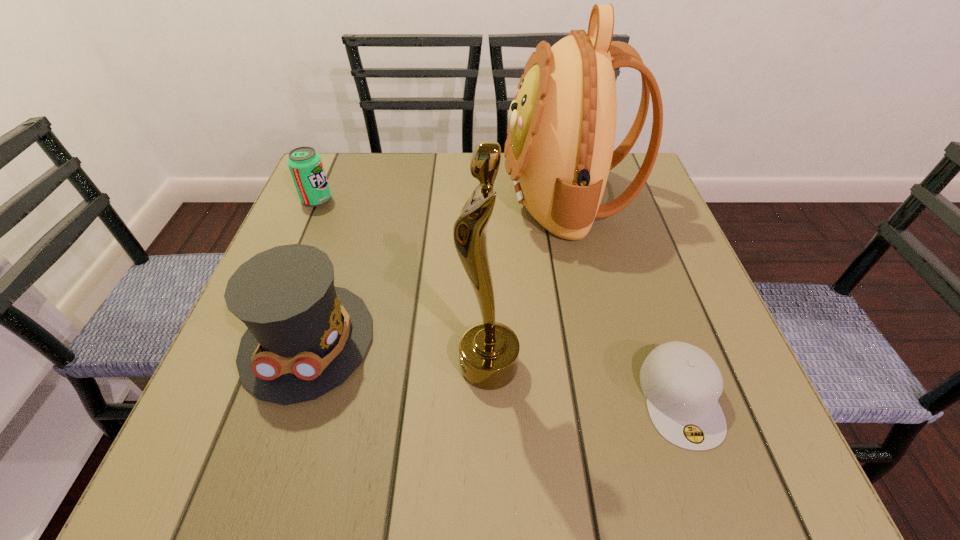
You are a GUI agent. You are given a task and a screenshot of the screen. Output one action in this format:
    pyautogui.click(x=<x>, y=<y>)
    Task: Click on the free space between the shortest object and the pop soda
    
    Given the screenshot: What is the action you would take?
    pyautogui.click(x=498, y=299)

The height and width of the screenshot is (540, 960). What are the coordinates of `free space that is in between the third tallest object and the backpack` in the screenshot? It's located at pos(437,269).

Where is `free spot between the cap and the award`? free spot between the cap and the award is located at coordinates (585, 382).

What are the coordinates of `free space between the backpack and the cap` in the screenshot? It's located at (623, 299).

Where is `empty location between the third tallest object and the award`? The height and width of the screenshot is (540, 960). empty location between the third tallest object and the award is located at coordinates (398, 353).

The width and height of the screenshot is (960, 540). In order to click on object that stands as the closest to the third shortest object in this screenshot , I will do `click(488, 351)`.

This screenshot has width=960, height=540. Find the location of `the second closest object to the second shortest object`. the second closest object to the second shortest object is located at coordinates (561, 132).

Image resolution: width=960 pixels, height=540 pixels. What are the coordinates of `free space that satisfies the following two spatial constraints: 1. on the front-facing side of the backpack; 2. with goggles on the front of the third shortest object` in the screenshot? It's located at (598, 340).

The image size is (960, 540). I want to click on free location that satisfies the following two spatial constraints: 1. on the front-facing side of the backpack; 2. with goggles on the front of the third shortest object, so click(598, 340).